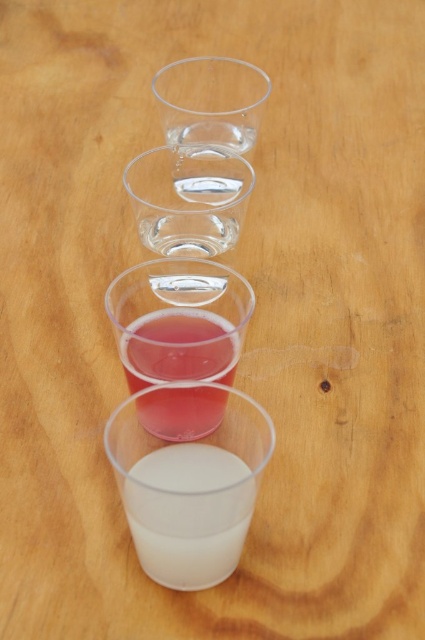
Question: Which object is farther from the camera taking this photo?

Choices:
 (A) translucent plastic cup at center
 (B) transparent plastic shot glass at center

Answer: (B)

Question: Estimate the real-world distances between objects in this image. Which object is closer to the white opaque cup at center?

Choices:
 (A) translucent plastic cup at center
 (B) transparent plastic shot glass at upper center

Answer: (A)

Question: Which point is farther from the camera taking this photo?

Choices:
 (A) pyautogui.click(x=141, y=417)
 (B) pyautogui.click(x=235, y=552)
 (C) pyautogui.click(x=155, y=221)
 (D) pyautogui.click(x=255, y=86)

Answer: (D)

Question: Is white opaque cup at center thinner than transparent plastic shot glass at upper center?

Choices:
 (A) yes
 (B) no

Answer: (A)

Question: Does transparent plastic shot glass at upper center have a greater width compared to transparent plastic shot glass at center?

Choices:
 (A) yes
 (B) no

Answer: (A)

Question: Can you confirm if transparent plastic shot glass at upper center is positioned to the right of translucent plastic cup at center?

Choices:
 (A) no
 (B) yes

Answer: (B)